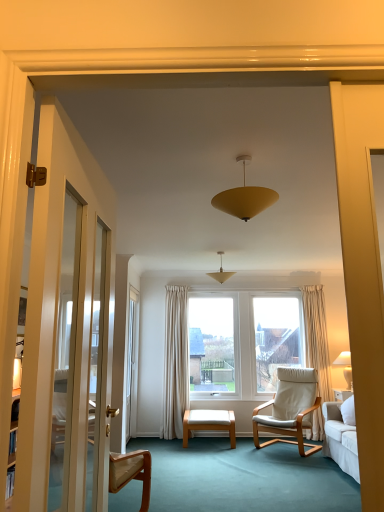
Measure the distance between white fabric chair at center and camera.

A distance of 4.63 meters exists between white fabric chair at center and camera.

At what (x,y) coordinates should I click in order to perform the action: click on white fabric chair at center. Please return your answer as a coordinate pair (x, y). Looking at the image, I should click on (290, 409).

Identify the location of matte yellow cone at center. (244, 197).

What do you see at coordinates (221, 272) in the screenshot? The width and height of the screenshot is (384, 512). I see `matte yellow cone at center` at bounding box center [221, 272].

Find the location of a particular element. The height and width of the screenshot is (512, 384). white fabric chair at center is located at coordinates (290, 409).

Is matte yellow cone at center oriented away from white glossy screen door at left?

No, matte yellow cone at center is not facing away from white glossy screen door at left.

Is matte yellow cone at center beside white glossy screen door at left?

There is a gap between matte yellow cone at center and white glossy screen door at left.

How different are the orientations of matte yellow cone at center and white glossy screen door at left in degrees?

The angular difference between matte yellow cone at center and white glossy screen door at left is 82 degrees.

From a real-world perspective, which is physically above, matte yellow cone at center or white glossy screen door at left?

From a 3D spatial view, matte yellow cone at center is above.

Is white wood stool at center next to white glossy screen door at left and touching it?

No, white wood stool at center is not touching white glossy screen door at left.

Is white wood stool at center further to camera compared to white glossy screen door at left?

Yes, the depth of white wood stool at center is greater than that of white glossy screen door at left.

Considering the sizes of objects white wood stool at center and white glossy screen door at left in the image provided, who is taller, white wood stool at center or white glossy screen door at left?

white glossy screen door at left.

Who is taller, white fabric chair at center or white glossy screen door at left?

Standing taller between the two is white glossy screen door at left.

Consider the image. Can you confirm if white fabric chair at center is smaller than white glossy screen door at left?

Incorrect, white fabric chair at center is not smaller in size than white glossy screen door at left.

Is white fabric chair at center in front of white glossy screen door at left?

Yes, white fabric chair at center is closer to the camera.

Could you tell me if white fabric chair at center is turned towards white glossy screen door at left?

No, white fabric chair at center is not facing towards white glossy screen door at left.

Can you confirm if white wood stool at center is wider than matte yellow cone at center?

Yes.

Who is shorter, white wood stool at center or matte yellow cone at center?

white wood stool at center is shorter.

From the picture: Are white wood stool at center and matte yellow cone at center far apart?

Indeed, white wood stool at center is not near matte yellow cone at center.

Considering the relative positions of white wood stool at center and matte yellow cone at center in the image provided, is white wood stool at center behind matte yellow cone at center?

That is True.

You are a GUI agent. You are given a task and a screenshot of the screen. Output one action in this format:
    pyautogui.click(x=<x>, y=<y>)
    Task: Click on the desk to the right of white glossy screen door at left
    
    Given the screenshot: What is the action you would take?
    pyautogui.click(x=209, y=423)

Is white glossy screen door at left looking in the opposite direction of white wood stool at center?

No, white glossy screen door at left is not facing the opposite direction of white wood stool at center.

Does white glossy screen door at left have a smaller size compared to white wood stool at center?

No, white glossy screen door at left is not smaller than white wood stool at center.

Is white wood stool at center inside white glossy screen door at left?

No, white wood stool at center is not a part of white glossy screen door at left.

From the image's perspective, between white glossy screen door at left and white fabric chair at center, who is located below?

white fabric chair at center appears lower in the image.

Relative to white fabric chair at center, is white glossy screen door at left in front or behind?

Visually, white glossy screen door at left is located behind white fabric chair at center.

Between white glossy screen door at left and white fabric chair at center, which one appears on the left side from the viewer's perspective?

From the viewer's perspective, white glossy screen door at left appears more on the left side.

Considering the relative sizes of white glossy screen door at left and white fabric chair at center in the image provided, is white glossy screen door at left bigger than white fabric chair at center?

Incorrect, white glossy screen door at left is not larger than white fabric chair at center.

Is white glossy screen door at left at the right side of matte yellow cone at center?

No, white glossy screen door at left is not to the right of matte yellow cone at center.

Does point (131, 336) appear closer or farther from the camera than point (275, 191)?

Point (131, 336).

From the image's perspective, between white glossy screen door at left and matte yellow cone at center, who is located below?

From the image's view, white glossy screen door at left is below.

The width and height of the screenshot is (384, 512). I want to click on screen door below the matte yellow cone at center (from the image's perspective), so click(131, 364).

At what (x,y) coordinates should I click in order to perform the action: click on screen door that is on the left side of matte yellow cone at center. Please return your answer as a coordinate pair (x, y). The height and width of the screenshot is (512, 384). Looking at the image, I should click on (131, 364).

Find the location of a particular element. This screenshot has height=512, width=384. screen door located above the white wood stool at center (from the image's perspective) is located at coordinates (131, 364).

Considering their positions, is white wood stool at center positioned further to white fabric chair at center than matte yellow cone at center?

Among the two, matte yellow cone at center is located further to white fabric chair at center.

Estimate the real-world distances between objects in this image. Which object is closer to white glossy screen door at left, white wood stool at center or matte yellow cone at center?

Among the two, white wood stool at center is located nearer to white glossy screen door at left.

When comparing their distances from matte yellow cone at center, does matte yellow cone at center or white fabric chair at center seem further?

white fabric chair at center is positioned further to the anchor matte yellow cone at center.

When comparing their distances from matte yellow cone at center, does white fabric chair at center or white glossy screen door at left seem further?

white glossy screen door at left.

Considering their positions, is white glossy screen door at left positioned further to white fabric chair at center than white wood stool at center?

Among the two, white glossy screen door at left is located further to white fabric chair at center.

Looking at the image, which one is located closer to white glossy screen door at left, white fabric chair at center or white wood stool at center?

The object closer to white glossy screen door at left is white wood stool at center.

From the image, which object appears to be farther from white wood stool at center, matte yellow cone at center or white fabric chair at center?

matte yellow cone at center is further to white wood stool at center.

Considering their positions, is matte yellow cone at center positioned further to white wood stool at center than matte yellow cone at center?

Based on the image, matte yellow cone at center appears to be further to white wood stool at center.

The image size is (384, 512). What are the coordinates of `screen door between matte yellow cone at center and white wood stool at center from top to bottom` in the screenshot? It's located at (131, 364).

This screenshot has height=512, width=384. Find the location of `light fixture positioned between matte yellow cone at center and white wood stool at center from near to far`. light fixture positioned between matte yellow cone at center and white wood stool at center from near to far is located at coordinates pos(221,272).

In order to click on light fixture positioned between matte yellow cone at center and white fabric chair at center from near to far in this screenshot , I will do `click(221, 272)`.

Identify the location of screen door between matte yellow cone at center and white wood stool at center in the front-back direction. (131, 364).